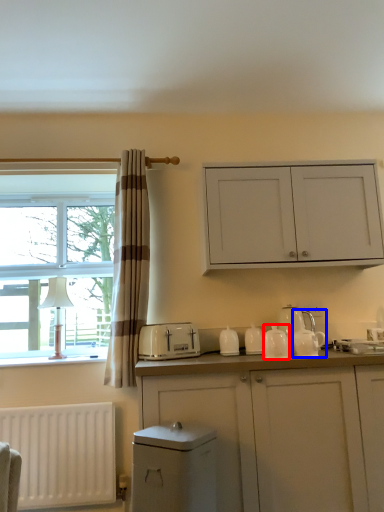
Question: Which object is further to the camera taking this photo, tableware (highlighted by a red box) or tea pot (highlighted by a blue box)?

Choices:
 (A) tableware
 (B) tea pot

Answer: (A)